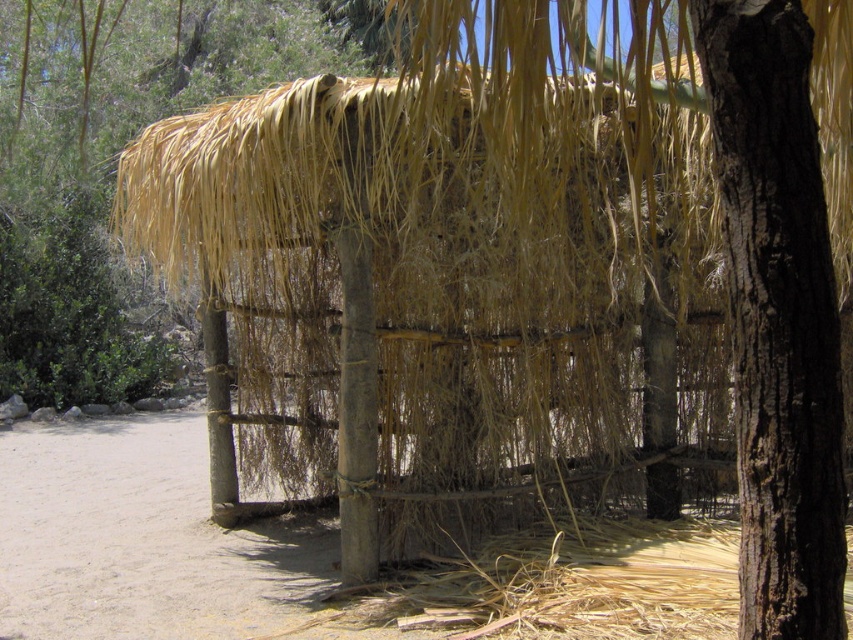
You are standing at the entrance of the rustic shelter and notice a point marked at coordinates (x=776, y=316). What does this point indicate in the scene?

The point at coordinates (x=776, y=316) marks the location of the brown rough bark tree at center.

You are standing in front of the rustic shelter and notice two structures at the center. Which one is taller between the brown rough bark tree at center and the brown rough wood pole at center?

The brown rough bark tree at center is taller than the brown rough wood pole at center.